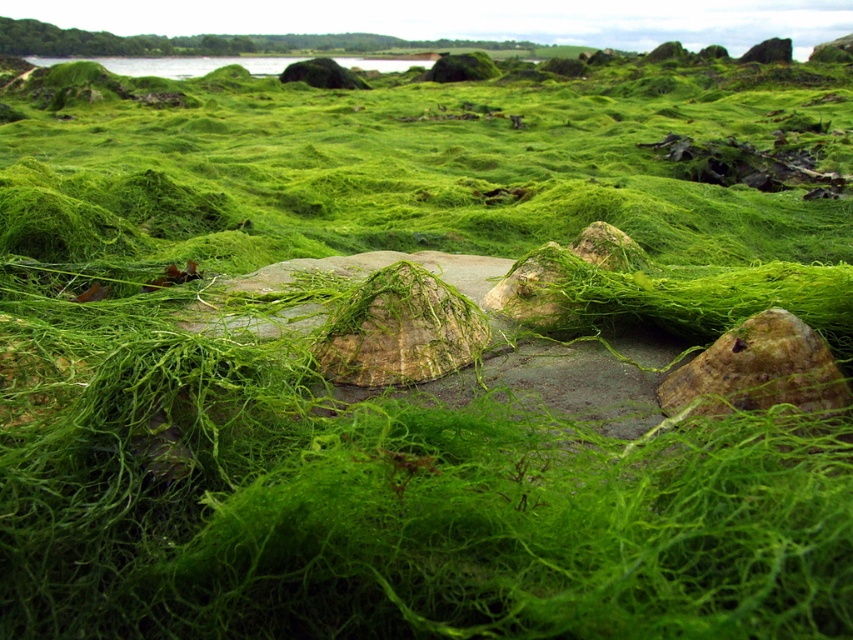
Who is positioned more to the left, brown textured stone at center or green mossy water at upper center?

From the viewer's perspective, green mossy water at upper center appears more on the left side.

Is brown textured stone at center shorter than green mossy water at upper center?

Correct, brown textured stone at center is not as tall as green mossy water at upper center.

Between point (821, 356) and point (119, 58), which one is positioned in front?

Point (821, 356)

Find the location of a particular element. The image size is (853, 640). brown textured stone at center is located at coordinates (757, 371).